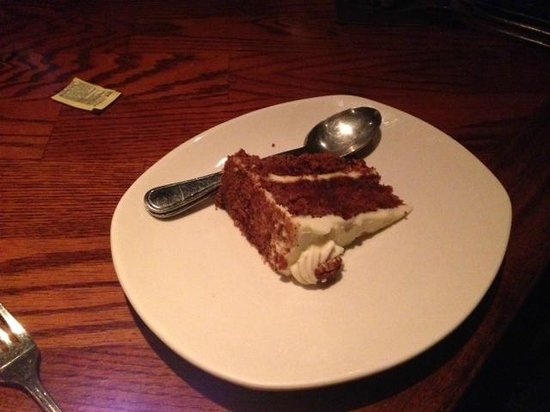
Locate an element on the screen. spoon handle is located at coordinates (191, 193).